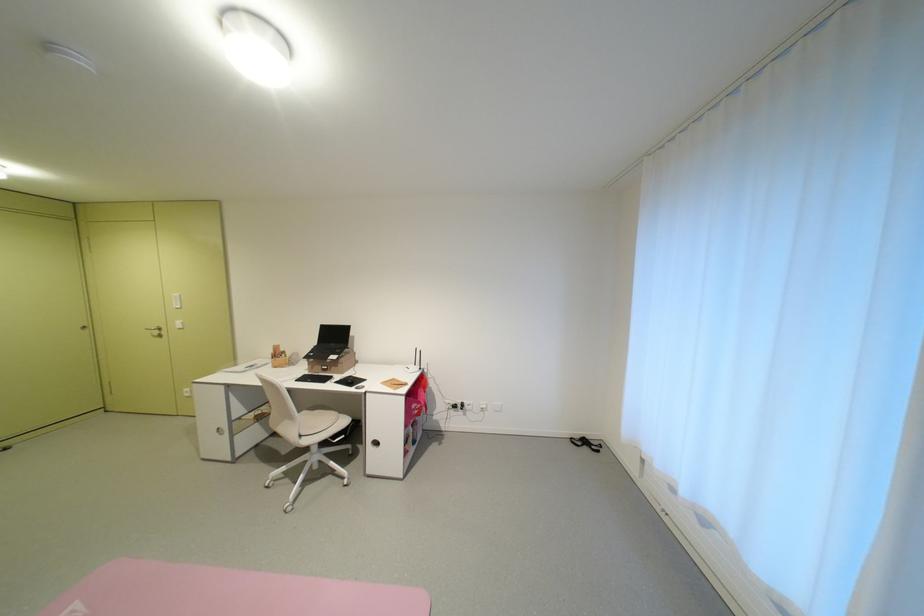
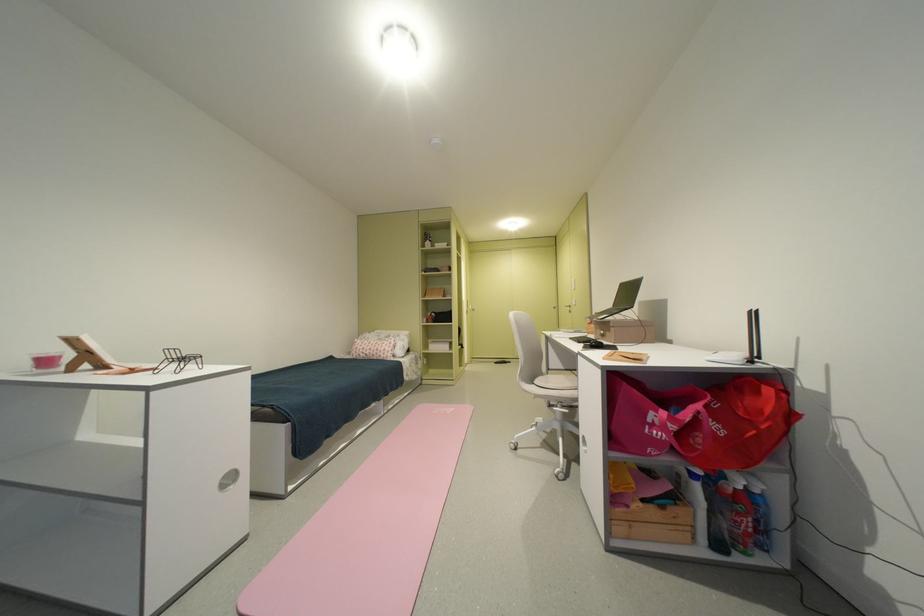
Where in the second image is the point corresponding to (x=346, y=368) from the first image?

(618, 331)